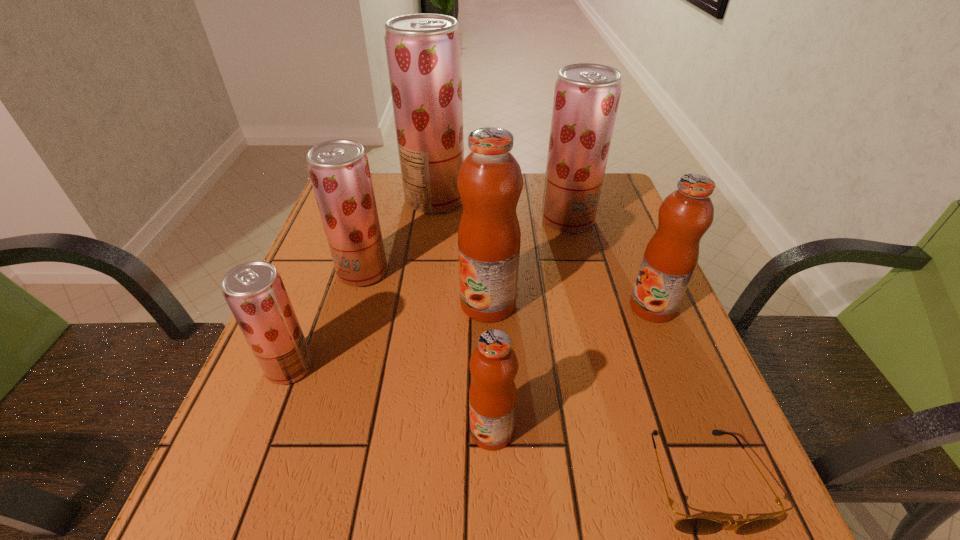
You are a GUI agent. You are given a task and a screenshot of the screen. Output one action in this format:
    pyautogui.click(x=<x>, y=<y>)
    Task: Click on the object positioned at the near right corner
    
    Given the screenshot: What is the action you would take?
    pyautogui.click(x=693, y=525)

Find the location of a particular element. The width and height of the screenshot is (960, 540). free spot at the far edge of the desktop is located at coordinates (536, 173).

Find the location of `vacant area at the near edge`. vacant area at the near edge is located at coordinates (541, 518).

In the image, there is a desktop. Where is `free space at the left edge`? This screenshot has height=540, width=960. free space at the left edge is located at coordinates (299, 315).

The width and height of the screenshot is (960, 540). I want to click on blank space at the right edge, so click(612, 224).

Find the location of a particular element. vacant area at the far left corner is located at coordinates click(374, 190).

You are a GUI agent. You are given a task and a screenshot of the screen. Output one action in this format:
    pyautogui.click(x=<x>, y=<y>)
    Task: Click on the vacant area that lies between the rightmost strawberry fruit juice and the sunglasses
    This screenshot has width=960, height=540.
    Given the screenshot: What is the action you would take?
    pyautogui.click(x=635, y=350)

You are a GUI agent. You are given a task and a screenshot of the screen. Output one action in this format:
    pyautogui.click(x=<x>, y=<y>)
    Task: Click on the free area in between the rightmost orange fruit juice and the biggest orange fruit juice
    The width and height of the screenshot is (960, 540).
    Given the screenshot: What is the action you would take?
    pyautogui.click(x=570, y=305)

The height and width of the screenshot is (540, 960). Identify the location of free area in between the nearest orange fruit juice and the second smallest strawberry fruit juice. (427, 352).

Image resolution: width=960 pixels, height=540 pixels. I want to click on blank region between the biggest orange fruit juice and the second nearest strawberry fruit juice, so click(x=425, y=288).